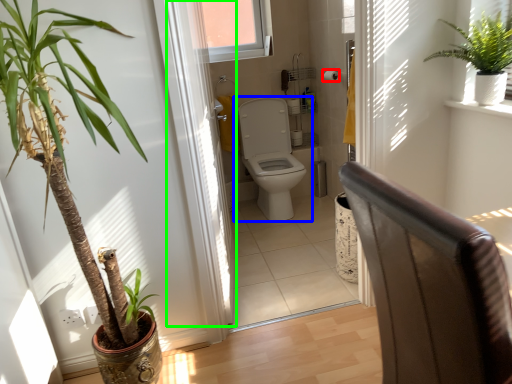
Question: Estimate the real-world distances between objects in this image. Which object is farther from toilet paper (highlighted by a red box), toilet (highlighted by a blue box) or screen door (highlighted by a green box)?

Choices:
 (A) toilet
 (B) screen door

Answer: (B)